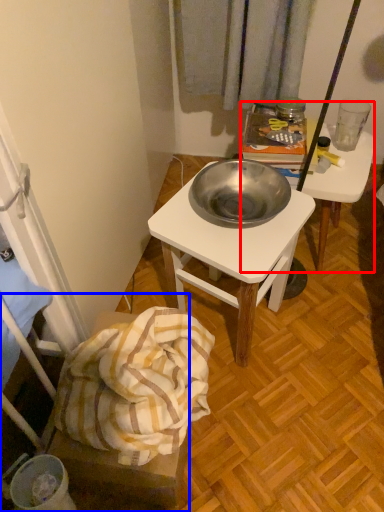
Question: Which of the following is the farthest to the observer, desk (highlighted by a red box) or furniture (highlighted by a blue box)?

Choices:
 (A) desk
 (B) furniture

Answer: (A)